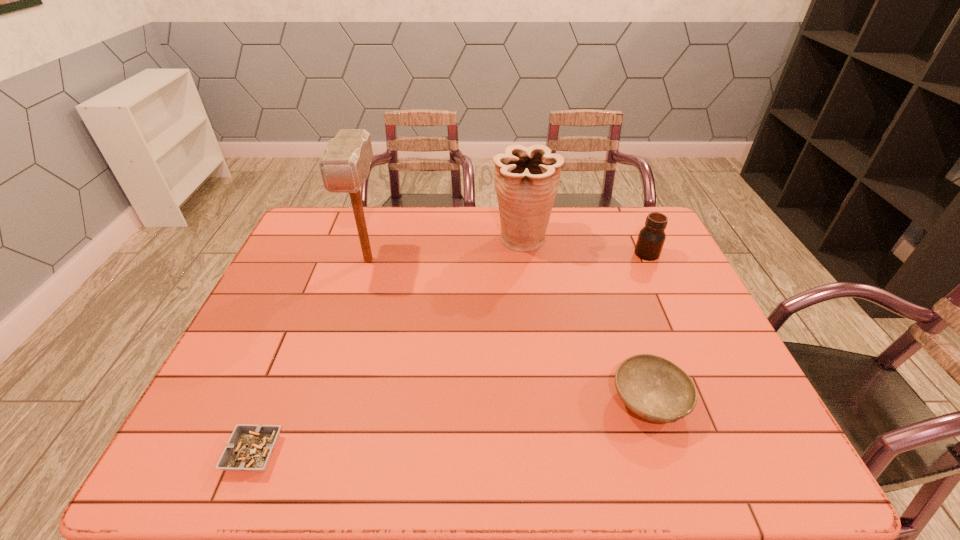
Locate an element on the screen. The image size is (960, 540). object present at the left edge is located at coordinates (250, 447).

The width and height of the screenshot is (960, 540). In order to click on jar at the right edge in this screenshot , I will do `click(651, 238)`.

At what (x,y) coordinates should I click in order to perform the action: click on bowl that is at the right edge. Please return your answer as a coordinate pair (x, y). This screenshot has height=540, width=960. Looking at the image, I should click on (654, 388).

The image size is (960, 540). Find the location of `object present at the near left corner`. object present at the near left corner is located at coordinates (250, 447).

Locate an element on the screen. The height and width of the screenshot is (540, 960). object that is at the far right corner is located at coordinates (651, 238).

Identify the location of object that is positioned at the near right corner. (654, 388).

This screenshot has height=540, width=960. Identify the location of vacant area at the far edge. (430, 210).

This screenshot has width=960, height=540. In the image, there is a desktop. What are the coordinates of `vacant space at the near edge` in the screenshot? It's located at (487, 436).

Locate an element on the screen. This screenshot has width=960, height=540. vacant space at the left edge of the desktop is located at coordinates (251, 336).

At what (x,y) coordinates should I click in order to perform the action: click on vacant space at the right edge of the desktop. Please return your answer as a coordinate pair (x, y). Looking at the image, I should click on (690, 353).